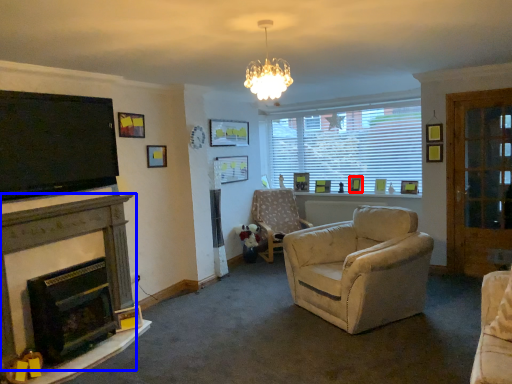
Question: Which object appears farthest to the camera in this image, picture frame (highlighted by a red box) or fireplace (highlighted by a blue box)?

Choices:
 (A) picture frame
 (B) fireplace

Answer: (A)